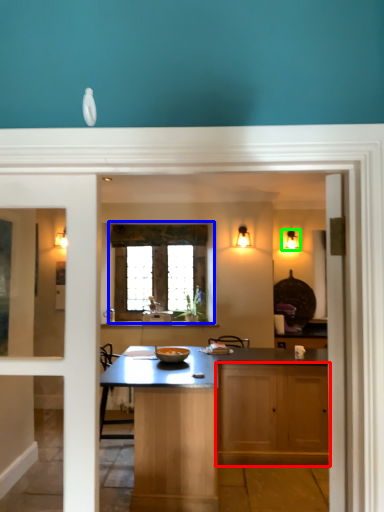
Question: Considering the real-world distances, which object is farthest from cabinetry (highlighted by a red box)? window (highlighted by a blue box) or light fixture (highlighted by a green box)?

Choices:
 (A) window
 (B) light fixture

Answer: (B)